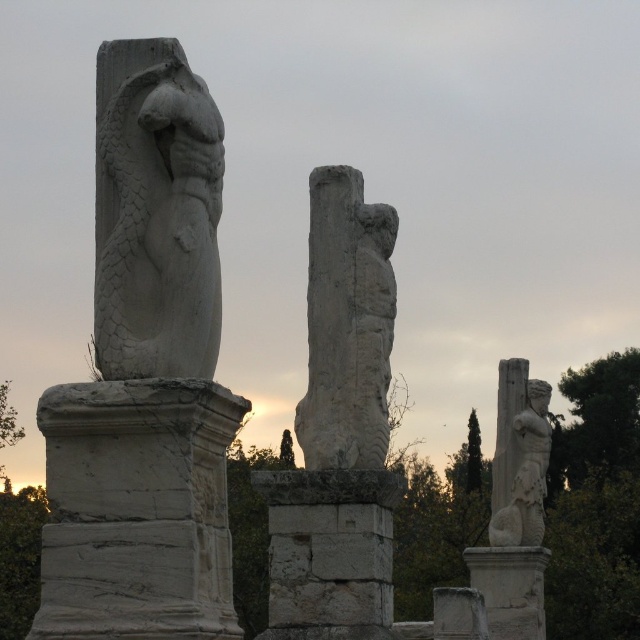
You are an archaeologist standing at the center of the archaeological site. You need to locate the white stone pillar at left. According to the coordinates provided, where should you look to find it?

The white stone pillar at left is located at coordinates point (136, 509).

You are an archaeologist examining the ancient site. You notice the white stone pillar at left and the white stone figure at center. Which object is closer to you based on their positions in the scene?

The white stone pillar at left is closer to you because it is in front of the white stone figure at center.